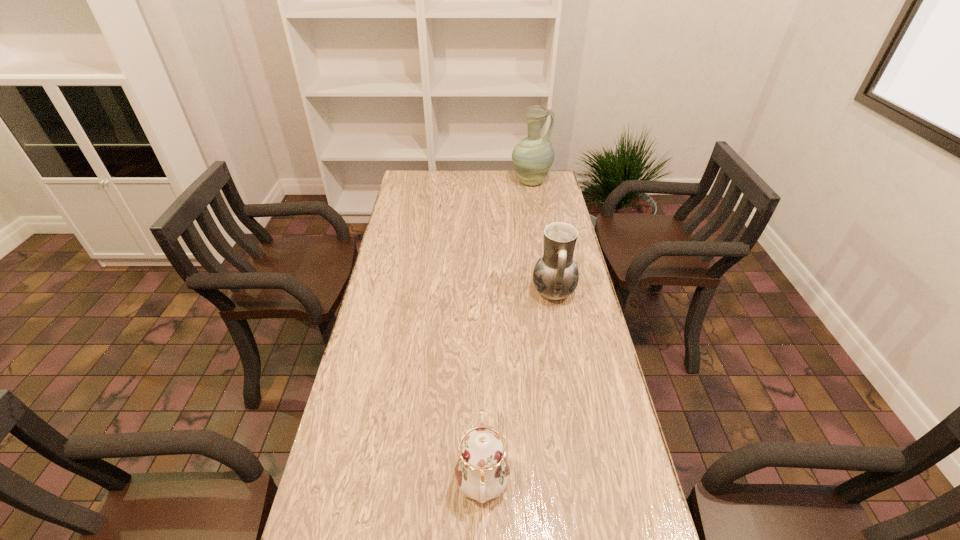
Identify the location of object at the far edge. The height and width of the screenshot is (540, 960). (533, 156).

The height and width of the screenshot is (540, 960). Identify the location of object that is at the far right corner. 533,156.

The image size is (960, 540). In the image, there is a desktop. Find the location of `free space at the left edge`. free space at the left edge is located at coordinates (387, 389).

Identify the location of free space at the right edge of the desktop. (546, 335).

Locate an element on the screen. This screenshot has height=540, width=960. vacant space at the far left corner of the desktop is located at coordinates (403, 184).

The image size is (960, 540). In order to click on free location at the far right corner in this screenshot , I will do `click(560, 188)`.

At what (x,y) coordinates should I click in order to perform the action: click on unoccupied area between the second nearest object and the taller pitcher. Please return your answer as a coordinate pair (x, y). Looking at the image, I should click on (542, 237).

The image size is (960, 540). Find the location of `unoccupied area between the shorter pitcher and the nearest object`. unoccupied area between the shorter pitcher and the nearest object is located at coordinates (517, 388).

You are a GUI agent. You are given a task and a screenshot of the screen. Output one action in this format:
    pyautogui.click(x=<x>, y=<y>)
    Task: Click on the free spot between the second tallest object and the farther pitcher
    This screenshot has width=960, height=540.
    Given the screenshot: What is the action you would take?
    pyautogui.click(x=542, y=237)

Locate an element on the screen. The width and height of the screenshot is (960, 540). unoccupied position between the tallest object and the second shortest object is located at coordinates (542, 237).